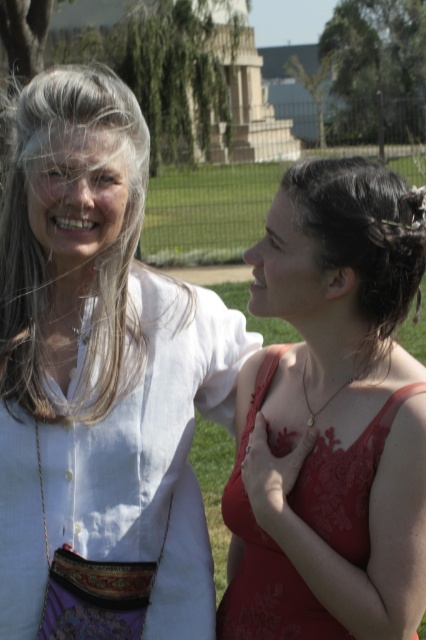
Find the location of a particular element. The height and width of the screenshot is (640, 426). lace fabric dress at center is located at coordinates (265, 557).

Does point (305, 605) come farther from viewer compared to point (319, 259)?

Yes.

Is point (322, 621) positioned behind point (405, 225)?

Yes, point (322, 621) is farther from viewer.

What are the coordinates of `lace fabric dress at center` in the screenshot? It's located at (265, 557).

Is white cotton shirt at upper left further to the viewer compared to lace fabric dress at center?

Yes, it is.

What do you see at coordinates (100, 381) in the screenshot?
I see `white cotton shirt at upper left` at bounding box center [100, 381].

Find the location of a particular element. Image resolution: width=426 pixels, height=640 pixels. white cotton shirt at upper left is located at coordinates (x=100, y=381).

In the scene shown: Between white cotton shirt at upper left and grayhair at left, which one is positioned lower?

white cotton shirt at upper left is below.

The width and height of the screenshot is (426, 640). What do you see at coordinates (100, 381) in the screenshot? I see `white cotton shirt at upper left` at bounding box center [100, 381].

Where is `white cotton shirt at upper left`? The height and width of the screenshot is (640, 426). white cotton shirt at upper left is located at coordinates (100, 381).